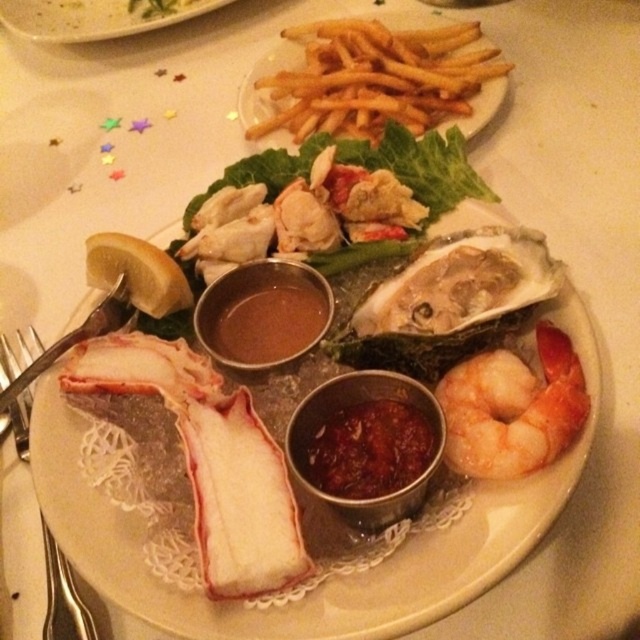
You are a diner who wants to eat the shiny pink shrimp at center. You have a silver metallic fork at lower left. Can you use the fork to reach the shrimp?

The shiny pink shrimp at center is shorter than the silver metallic fork at lower left, so the fork is long enough to reach the shrimp.

You are a diner at a seafood restaurant and want to pick up the shiny pink shrimp at center using the silver metallic fork at lower left. Based on their positions, can you reach the shrimp with the fork without moving either item?

The shiny pink shrimp at center is positioned on the right side of the silver metallic fork at lower left, so yes, you can reach the shrimp with the fork without moving either item.